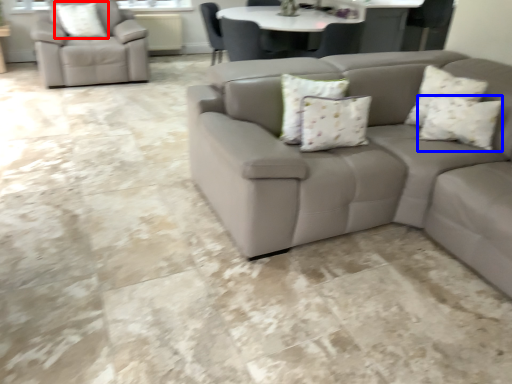
Question: Which of the following is the closest to the observer, pillow (highlighted by a red box) or pillow (highlighted by a blue box)?

Choices:
 (A) pillow
 (B) pillow

Answer: (B)